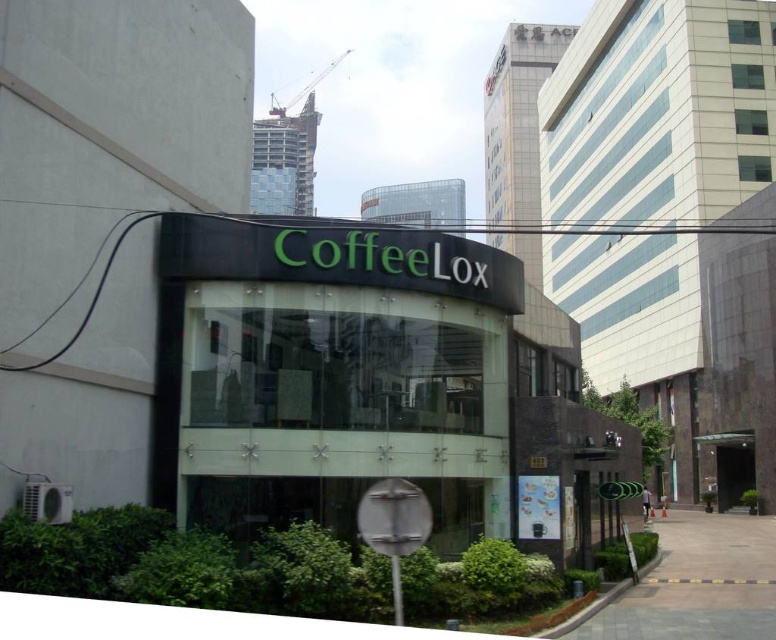
Question: Which of the following is the farthest from the observer?

Choices:
 (A) click(x=352, y=51)
 (B) click(x=674, y=584)

Answer: (A)

Question: Does paved stone pavement at center have a smaller size compared to metallic gray crane at upper center?

Choices:
 (A) no
 (B) yes

Answer: (B)

Question: In this image, where is paved stone pavement at center located relative to metallic gray crane at upper center?

Choices:
 (A) right
 (B) left

Answer: (A)

Question: Which object is farther from the camera taking this photo?

Choices:
 (A) metallic gray crane at upper center
 (B) paved stone pavement at center

Answer: (A)

Question: Among these points, which one is farthest from the camera?

Choices:
 (A) (310, 86)
 (B) (712, 531)

Answer: (A)

Question: Is paved stone pavement at center to the right of metallic gray crane at upper center from the viewer's perspective?

Choices:
 (A) no
 (B) yes

Answer: (B)